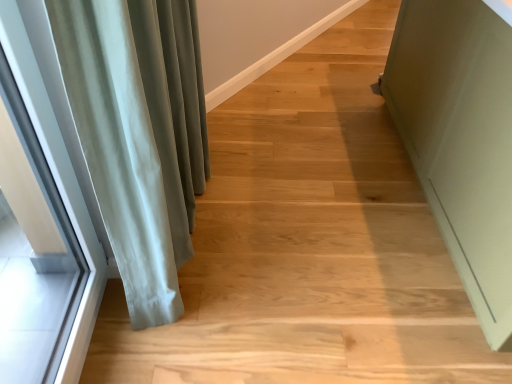
Question: From a real-world perspective, is matte green cabinet at right positioned above or below clear glass window at left?

Choices:
 (A) below
 (B) above

Answer: (A)

Question: Considering the positions of point (481, 97) and point (77, 210), is point (481, 97) closer or farther from the camera than point (77, 210)?

Choices:
 (A) closer
 (B) farther

Answer: (B)

Question: Estimate the real-world distances between objects in this image. Which object is farther from the satin green curtain at left?

Choices:
 (A) matte green cabinet at right
 (B) clear glass window at left

Answer: (A)

Question: Based on their relative distances, which object is farther from the matte green cabinet at right?

Choices:
 (A) satin green curtain at left
 (B) clear glass window at left

Answer: (B)